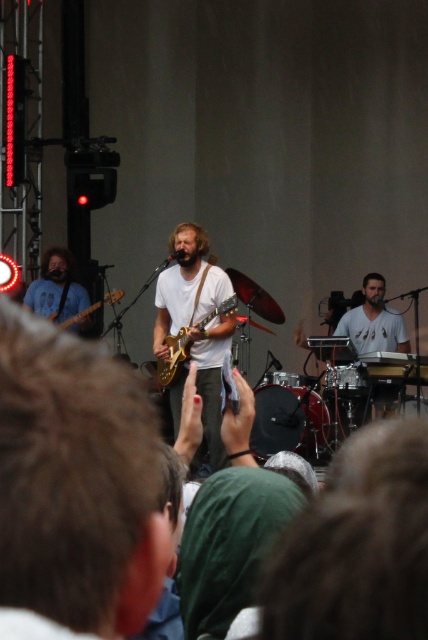
Question: Which point is closer to the camera taking this photo?

Choices:
 (A) (196, 300)
 (B) (171, 352)

Answer: (B)

Question: Which point is farther to the camera?

Choices:
 (A) white matte shirt at center
 (B) matte blue shirt at left

Answer: (B)

Question: Observing the image, what is the correct spatial positioning of white matte guitar at center in reference to shiny metallic guitar at center?

Choices:
 (A) below
 (B) above

Answer: (A)

Question: Does white matte guitar at center appear under shiny metallic guitar at center?

Choices:
 (A) no
 (B) yes

Answer: (B)

Question: Does matte blue shirt at left come in front of glossy wood guitar at center?

Choices:
 (A) no
 (B) yes

Answer: (A)

Question: Among these objects, which one is nearest to the camera?

Choices:
 (A) white matte shirt at center
 (B) matte blue shirt at left

Answer: (A)